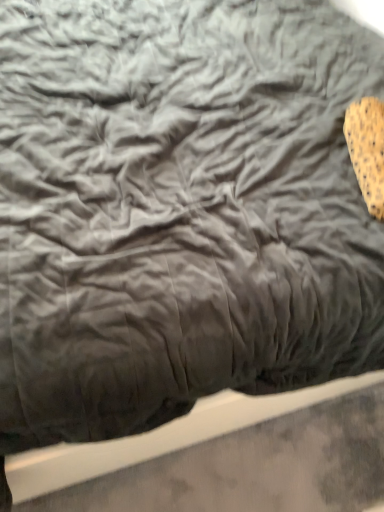
This screenshot has width=384, height=512. I want to click on brown speckled chip at upper right, so click(x=367, y=150).

This screenshot has height=512, width=384. What do you see at coordinates (367, 150) in the screenshot?
I see `brown speckled chip at upper right` at bounding box center [367, 150].

Locate an element on the screen. This screenshot has height=512, width=384. brown speckled chip at upper right is located at coordinates (367, 150).